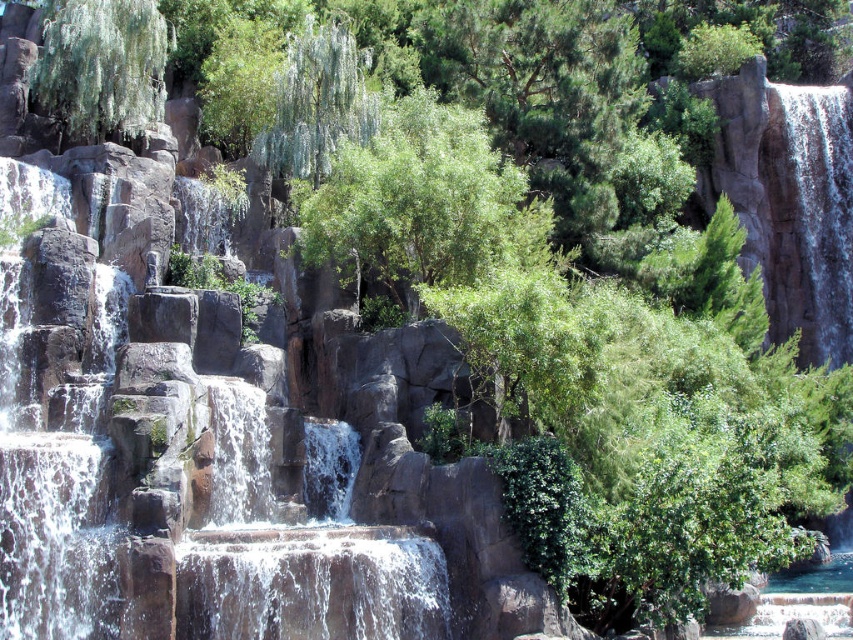
Question: Does white textured water at upper right have a larger size compared to green leafy tree at upper left?

Choices:
 (A) yes
 (B) no

Answer: (A)

Question: Can you confirm if green leafy tree at center is wider than green leafy tree at upper left?

Choices:
 (A) yes
 (B) no

Answer: (A)

Question: Which object is the closest to the green leafy tree at upper left?

Choices:
 (A) white textured water at upper right
 (B) green leafy tree at center

Answer: (B)

Question: Does white textured water at upper right have a larger size compared to green leafy tree at upper left?

Choices:
 (A) yes
 (B) no

Answer: (A)

Question: Which object is positioned farthest from the green leafy tree at center?

Choices:
 (A) white textured water at upper right
 (B) green leafy tree at upper left

Answer: (A)

Question: Which point is closer to the camera?

Choices:
 (A) green leafy tree at center
 (B) white textured water at upper right

Answer: (A)